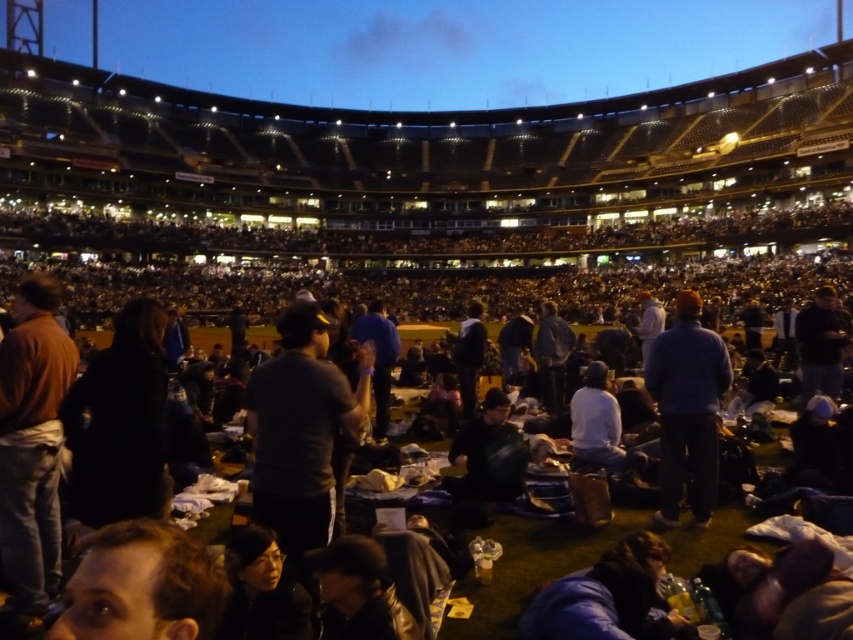
You are a photographer at the stadium and want to take a photo of the dark gray shirt at center and dark gray fabric jacket at center. Which object should you focus on first if you want to capture both in the same frame without moving the camera?

The dark gray shirt at center is much taller than the dark gray fabric jacket at center, so you should focus on the dark gray shirt at center first to ensure it is in focus before the jacket.

You are a photographer at the stadium and want to capture a photo of both the brown cotton shirt at left and the brown hair at lower left in the same frame. Based on their positions, which object should you focus on first to ensure both are in the shot?

The brown cotton shirt at left is to the left of brown hair at lower left, so you should focus on the brown cotton shirt at left first to include both in the frame.

Consider the image. You are a photographer standing at the edge of the field in the stadium. You want to take a photo that includes both the brown cotton shirt at left and the dark gray fabric jacket at center. Given that your camera has a maximum zoom range of 10 meters, will you be able to capture both subjects in a single frame without moving your position?

The distance between the brown cotton shirt at left and the dark gray fabric jacket at center is 19.64 meters, which exceeds the camera maximum zoom range of 10 meters. Therefore, you cannot capture both subjects in a single frame without moving your position.